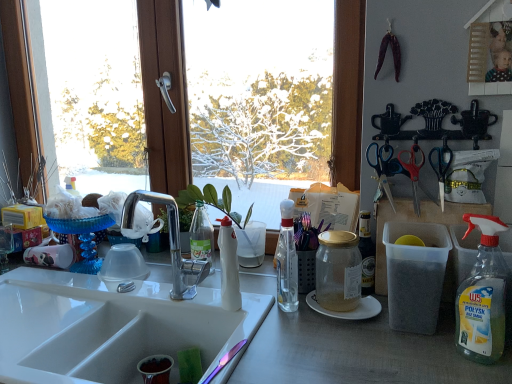
The image size is (512, 384). Identify the location of free point to the right of satin nickel faucet at sink center. (234, 311).